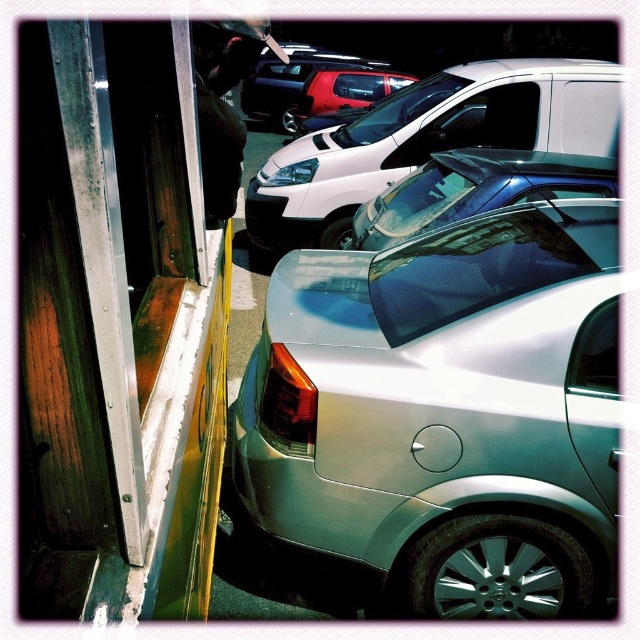
Question: Among these points, which one is nearest to the camera?

Choices:
 (A) (524, 176)
 (B) (378, 332)
 (C) (332, 109)
 (D) (472, 99)

Answer: (B)

Question: Observing the image, what is the correct spatial positioning of satin white van at center in reference to metallic red suv at center?

Choices:
 (A) right
 (B) left

Answer: (A)

Question: Does satin silver car at center appear on the right side of metallic red suv at center?

Choices:
 (A) no
 (B) yes

Answer: (B)

Question: In this image, where is satin white van at center located relative to metallic blue car at center?

Choices:
 (A) below
 (B) above

Answer: (B)

Question: Among these objects, which one is farthest from the camera?

Choices:
 (A) metallic blue car at center
 (B) satin white van at center

Answer: (B)

Question: Which object is closer to the camera taking this photo?

Choices:
 (A) satin white van at center
 (B) metallic red suv at center

Answer: (A)